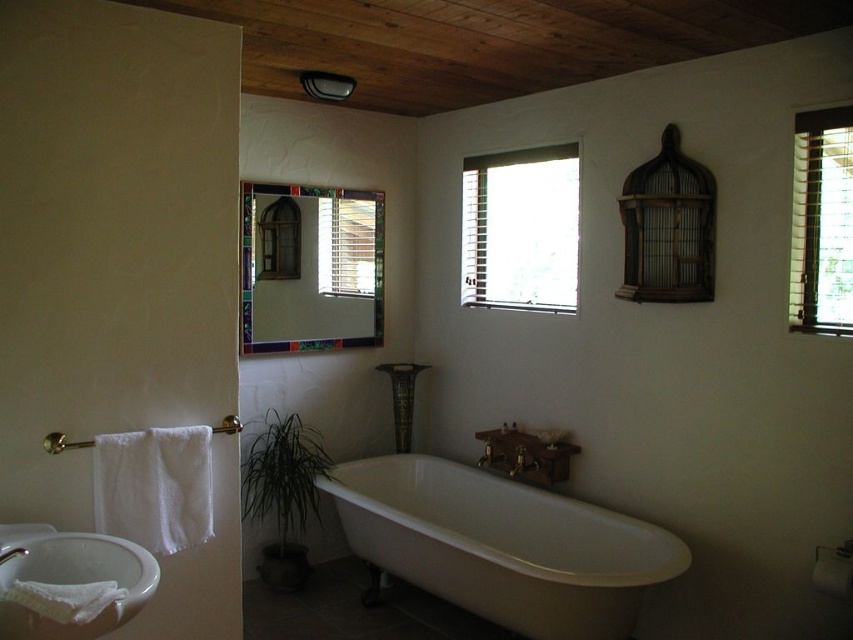
Does point (561, 544) lie in front of point (846, 195)?

No, (561, 544) is further to viewer.

Who is taller, white glossy bathtub at center or wooden blinds at upper right?

Standing taller between the two is wooden blinds at upper right.

Find the location of a particular element. The image size is (853, 640). white glossy bathtub at center is located at coordinates (502, 545).

Is white ceramic sink at lower left to the left of green leafy plant at lower left from the viewer's perspective?

Indeed, white ceramic sink at lower left is positioned on the left side of green leafy plant at lower left.

Is white ceramic sink at lower left positioned behind green leafy plant at lower left?

No, it is in front of green leafy plant at lower left.

Between point (24, 637) and point (291, 499), which one is positioned in front?

Positioned in front is point (24, 637).

The height and width of the screenshot is (640, 853). In order to click on white ceramic sink at lower left in this screenshot , I will do `click(74, 580)`.

Is transparent glass window at upper center closer to camera compared to green leafy plant at lower left?

Yes, transparent glass window at upper center is in front of green leafy plant at lower left.

Does transparent glass window at upper center appear under green leafy plant at lower left?

Actually, transparent glass window at upper center is above green leafy plant at lower left.

Between point (560, 164) and point (321, 465), which one is positioned in front?

Positioned in front is point (560, 164).

Where is `transparent glass window at upper center`? The width and height of the screenshot is (853, 640). transparent glass window at upper center is located at coordinates (520, 228).